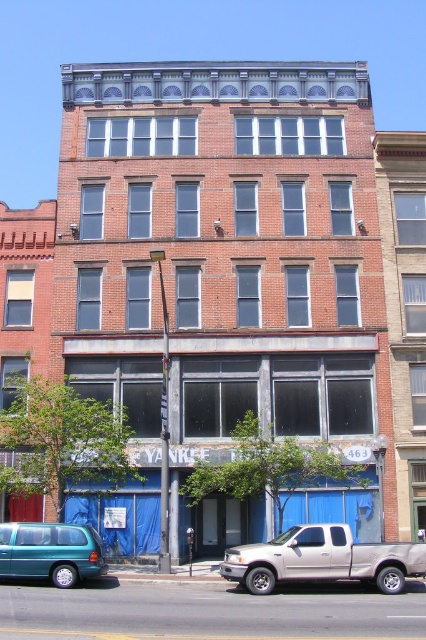
You are a delivery person trying to park your teal matte van at lower left next to the silver metallic truck at lower center. Considering their heights, which vehicle will have more clearance above them when parked side by side?

The teal matte van at lower left will have more clearance above it since the silver metallic truck at lower center is taller, meaning the van is shorter and thus has more space above.

You are a pedestrian standing in front of the building and want to cross the street. There is a silver metallic truck at lower center and a teal matte van at lower left blocking your path. Which vehicle should you move around first to reach the sidewalk?

The silver metallic truck at lower center is closer to the viewer than the teal matte van at lower left, so you should move around the silver metallic truck at lower center first to reach the sidewalk.

In the scene shown: You are a delivery driver who needs to park your teal matte van at lower left near the building. There is a silver metallic truck at lower center already parked. Based on the scene, can you park your van closer to the building than the truck?

The silver metallic truck at lower center is located below the teal matte van at lower left, which means the truck is closer to the building. Therefore, you cannot park the teal matte van at lower left any closer to the building than the truck is already positioned.